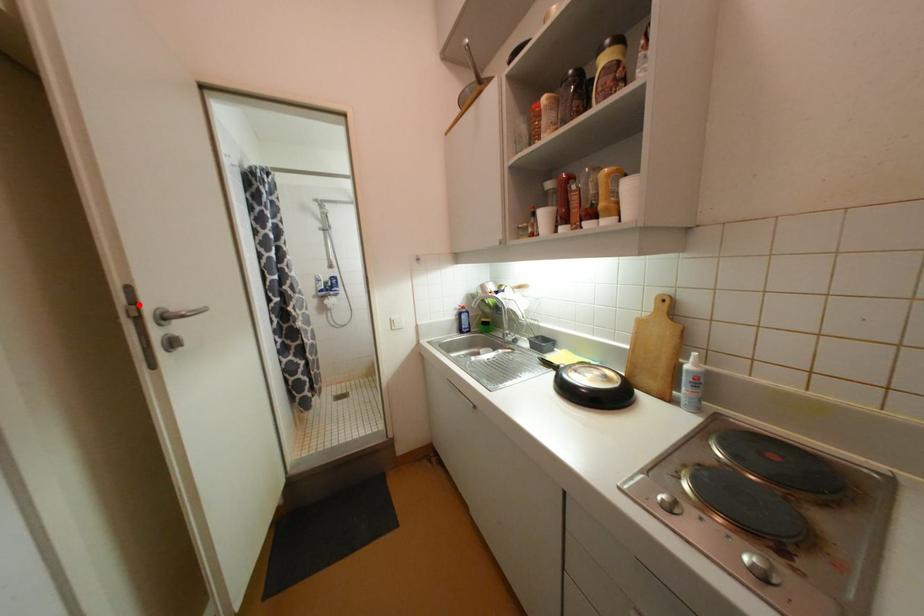
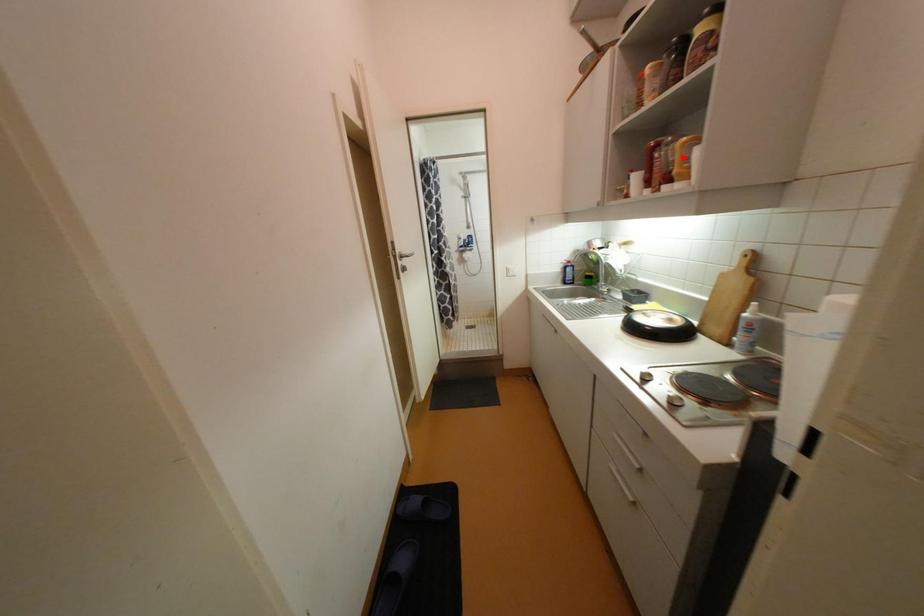
I am providing you with two images of the same scene from different viewpoints. A red point is marked on the first image and another point is marked on the second image. Is the marked point in image1 the same physical position as the marked point in image2?

No